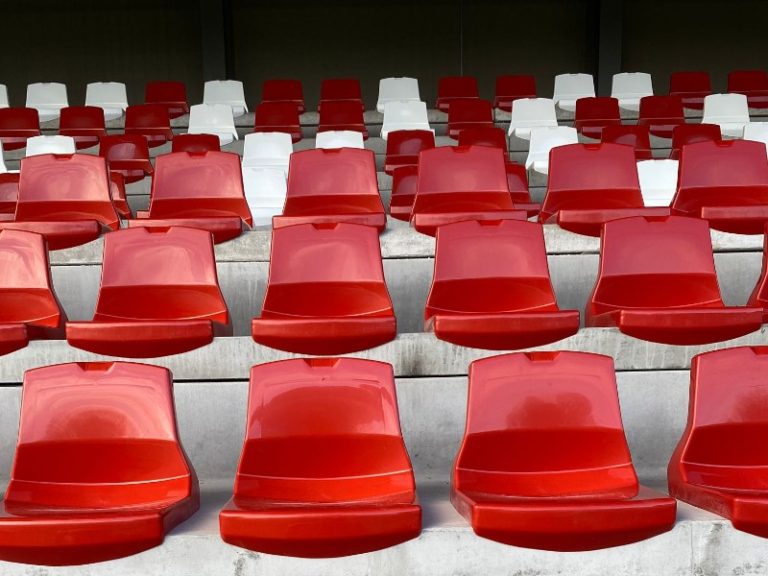
Locate an element on the screen. seats in the second row is located at coordinates pyautogui.click(x=8, y=270), pyautogui.click(x=164, y=285), pyautogui.click(x=332, y=279), pyautogui.click(x=501, y=279), pyautogui.click(x=667, y=264).